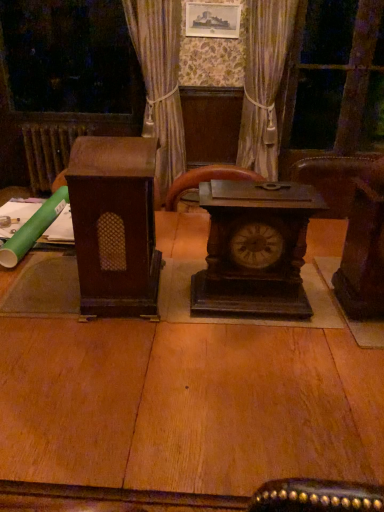
What are the coordinates of `unoccupied area in front of dark wood chair at right, the 1th furniture when ordered from right to left` in the screenshot? It's located at point(357,344).